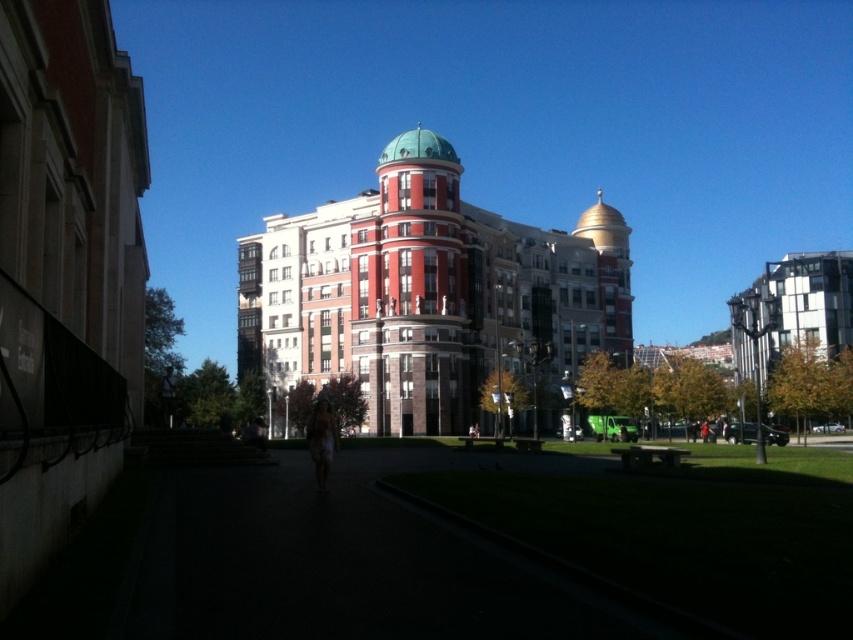
Question: Which object appears farthest from the camera in this image?

Choices:
 (A) teal dome at center
 (B) green dome at center

Answer: (A)

Question: Which point is closer to the camera?

Choices:
 (A) (544, 234)
 (B) (450, 161)

Answer: (B)

Question: Can you confirm if green dome at center is positioned below teal dome at center?

Choices:
 (A) yes
 (B) no

Answer: (A)

Question: Is green dome at center below teal dome at center?

Choices:
 (A) no
 (B) yes

Answer: (B)

Question: Does green dome at center appear on the right side of teal dome at center?

Choices:
 (A) yes
 (B) no

Answer: (A)